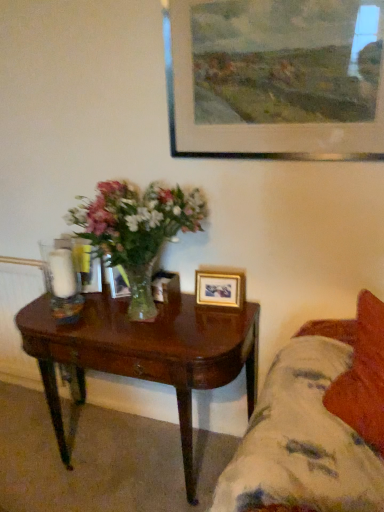
Question: From a real-world perspective, is wooden picture frame at center, which is counted as the first picture frame, starting from the back, physically located above or below gold metallic picture frame at lower right, placed as the second picture frame when sorted from bottom to top?

Choices:
 (A) above
 (B) below

Answer: (B)

Question: Is point (155, 278) closer or farther from the camera than point (230, 282)?

Choices:
 (A) farther
 (B) closer

Answer: (A)

Question: Estimate the real-world distances between objects in this image. Which object is closer to the fluffy fabric couch at lower right?

Choices:
 (A) wooden picture frame at center, the 3th picture frame when ordered from top to bottom
 (B) wooden picture frame at upper center, positioned as the third picture frame in back-to-front order
 (C) white glass candle holder at left
 (D) dark wood coffee table at lower left
 (E) gold metallic picture frame at lower right, positioned as the second picture frame in back-to-front order

Answer: (D)

Question: Which object is the closest to the wooden picture frame at center, which is the third picture frame in front-to-back order?

Choices:
 (A) wooden picture frame at upper center, acting as the first picture frame starting from the top
 (B) fluffy fabric couch at lower right
 (C) gold metallic picture frame at lower right, which is counted as the second picture frame, starting from the front
 (D) white glass candle holder at left
 (E) dark wood coffee table at lower left

Answer: (C)